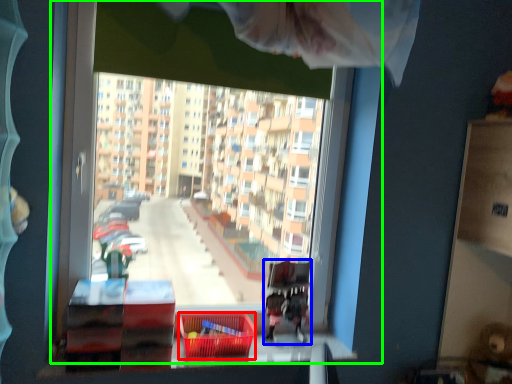
Question: Considering the real-world distances, which object is farthest from basket (highlighted by a red box)? bunk bed (highlighted by a blue box) or window (highlighted by a green box)?

Choices:
 (A) bunk bed
 (B) window

Answer: (B)